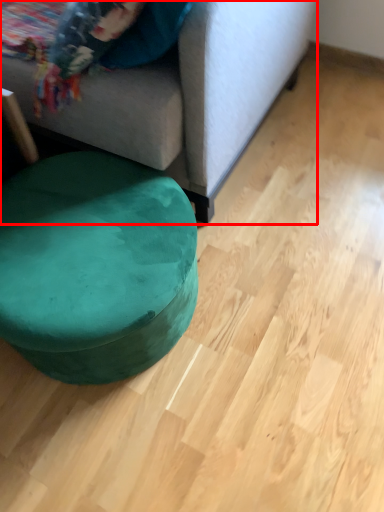
Question: In this image, where is studio couch (annotated by the red box) located relative to bean bag chair?

Choices:
 (A) left
 (B) right

Answer: (A)